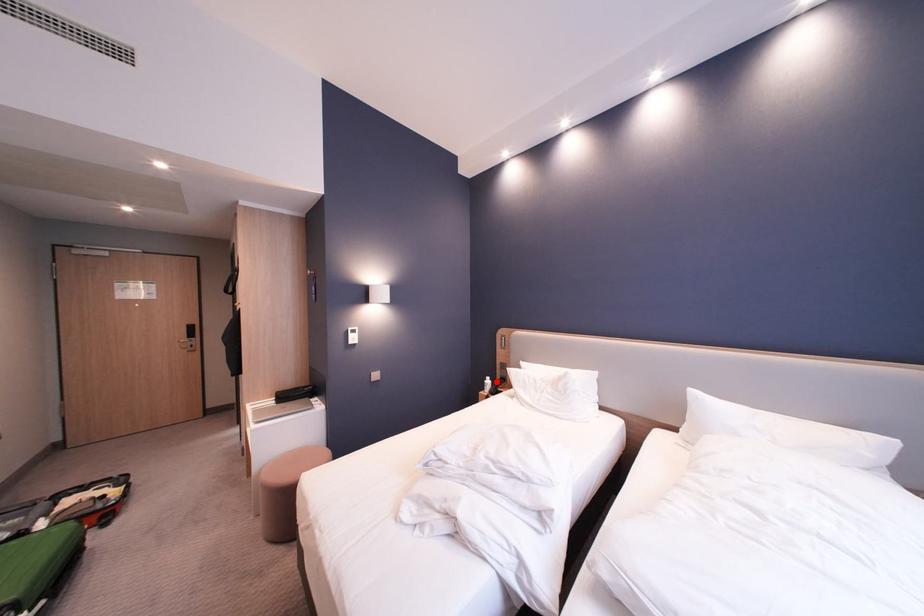
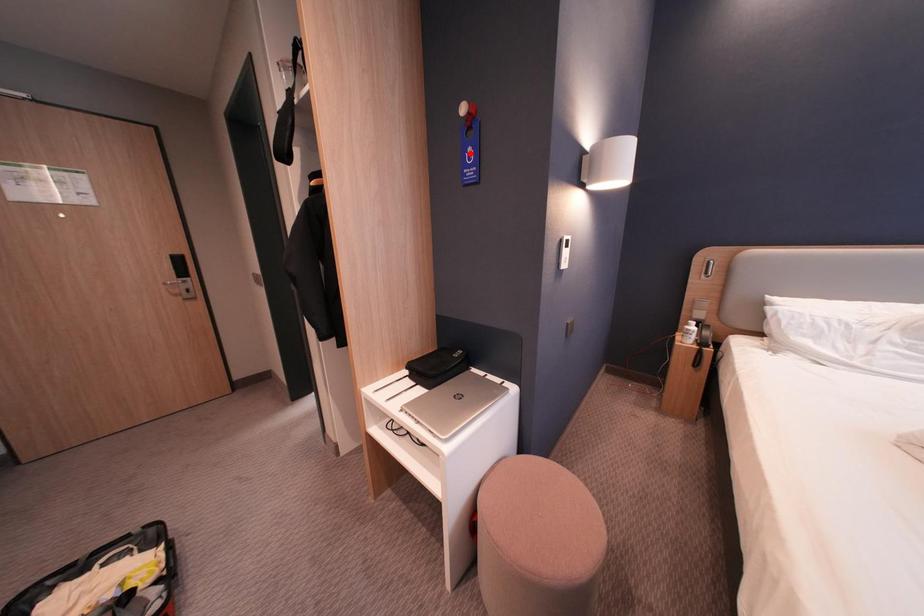
I am providing you with two images of the same scene from different viewpoints. A red point is marked on the first image and another point is marked on the second image. Does the point marked in image1 correspond to the same location as the one in image2?

No